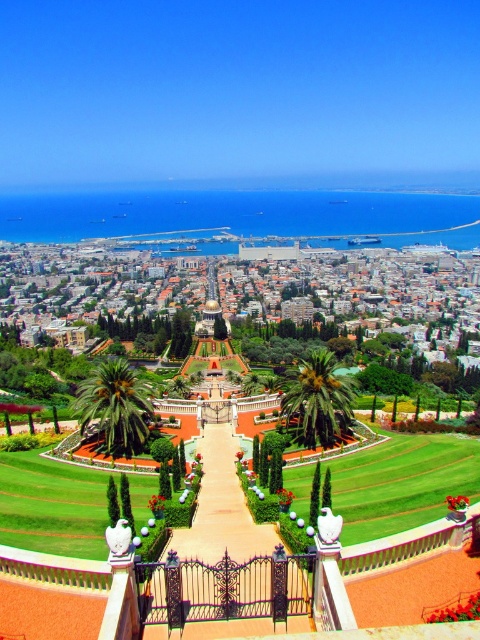
Question: Which point is farther to the camera?

Choices:
 (A) (96, 410)
 (B) (215, 490)

Answer: (A)

Question: Does metallic gate at center appear on the left side of green leafy palm tree at center?

Choices:
 (A) yes
 (B) no

Answer: (B)

Question: Which point is closer to the camera?

Choices:
 (A) (324, 394)
 (B) (140, 435)

Answer: (B)

Question: Estimate the real-world distances between objects in this image. Which object is closer to the green leafy palm at center?

Choices:
 (A) metallic gate at center
 (B) green leafy palm tree at center

Answer: (A)

Question: Does green leafy palm tree at center have a greater width compared to green leafy palm at center?

Choices:
 (A) yes
 (B) no

Answer: (A)

Question: Is metallic gate at center above green leafy palm at center?

Choices:
 (A) yes
 (B) no

Answer: (B)